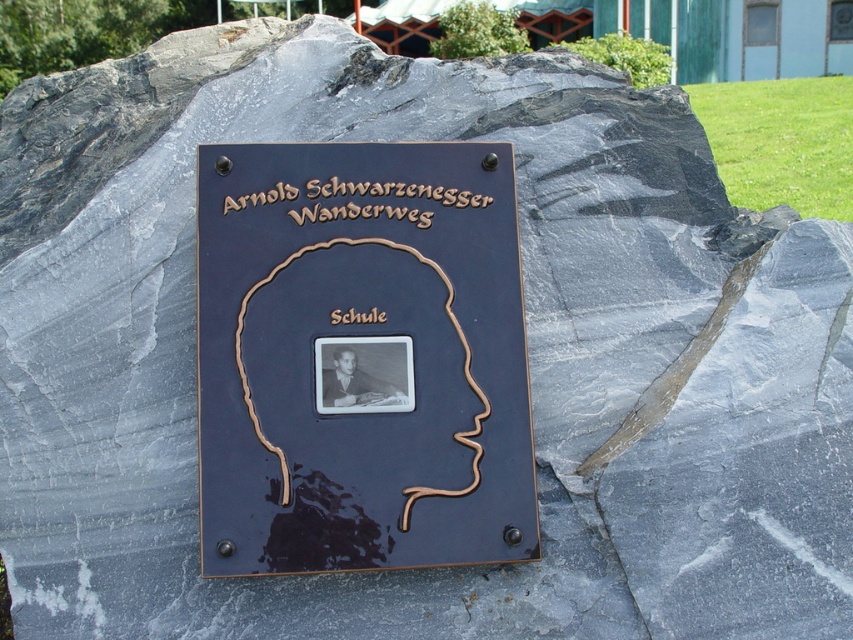
You are a hiker who has reached the Arnold Schwarzenegger Hiking Trail. You notice two plaques on the rock ahead. One is a black matte plaque at center and the other is a bronze plaque at upper center. Which plaque is taller?

The black matte plaque at center is taller than the bronze plaque at upper center.

You are a hiker who just arrived at the trailhead and see the bronze plaque at upper center and the brown wood sign at center. You want to read both but can only reach up to 5 feet. Can you reach both?

The distance between the bronze plaque at upper center and the brown wood sign at center is 7.96 inches. Since both are within your reach limit of 5 feet, you can reach both.

Looking at this image, you are a hiker who has just arrived at a trail marker. You see a bronze plaque at upper center and a brown wood sign at center. Which object is positioned to the left of the other?

The bronze plaque at upper center is to the left of brown wood sign at center.